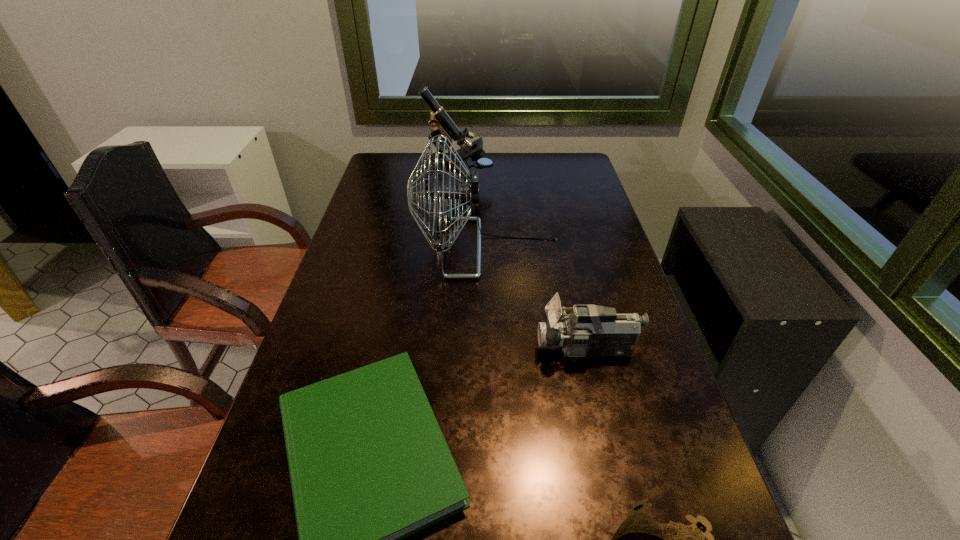
Identify the location of the farthest object. (440, 123).

Find the location of `fan`. fan is located at coordinates (468, 194).

At what (x,y) coordinates should I click in order to perform the action: click on camcorder. Please return your answer as a coordinate pair (x, y). The image size is (960, 540). Looking at the image, I should click on (590, 330).

Identify the location of blank space located through the eyepiece of the microscope. (592, 185).

Find the location of a particular element. vacant space located 0.220m on the front-facing side of the fourth nearest object is located at coordinates (343, 248).

The width and height of the screenshot is (960, 540). Identify the location of free point located on the front-facing side of the fourth nearest object. pyautogui.click(x=393, y=248).

This screenshot has width=960, height=540. I want to click on free region located on the front-facing side of the fourth nearest object, so click(x=349, y=248).

Locate an element on the screen. The width and height of the screenshot is (960, 540). vacant region located on the front-facing side of the camcorder is located at coordinates (482, 349).

Where is `vacant space situated on the front-facing side of the camcorder`? vacant space situated on the front-facing side of the camcorder is located at coordinates (491, 349).

Locate an element on the screen. free space located on the front-facing side of the camcorder is located at coordinates click(x=430, y=349).